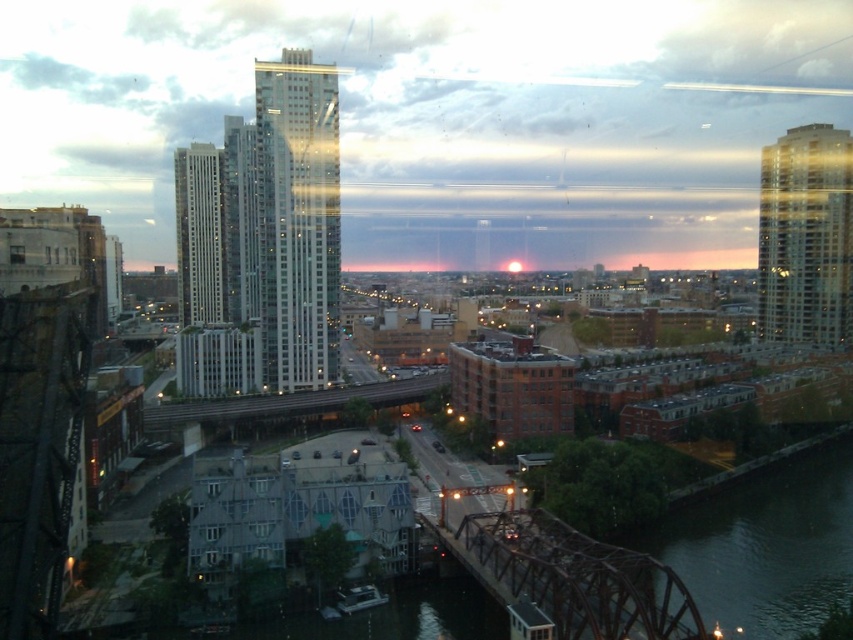
Is matte glass skyscraper at center further to the viewer compared to white glass skyscraper at center?

No, it is in front of white glass skyscraper at center.

Is matte glass skyscraper at center to the left of white glass skyscraper at center from the viewer's perspective?

No, matte glass skyscraper at center is not to the left of white glass skyscraper at center.

Does point (523, 141) lie behind point (200, 161)?

Yes, it is.

The height and width of the screenshot is (640, 853). Identify the location of matte glass skyscraper at center. (438, 116).

Between point (364, 241) and point (769, 202), which one is positioned behind?

Positioned behind is point (364, 241).

Is the position of matte glass skyscraper at center less distant than that of glassy reflective skyscraper at upper right?

Yes, it is.

Who is more forward, (x=485, y=134) or (x=844, y=257)?

Point (x=844, y=257)

The width and height of the screenshot is (853, 640). I want to click on matte glass skyscraper at center, so [x=438, y=116].

From the picture: Is glassy reflective skyscraper at center taller than glassy reflective skyscraper at upper right?

Yes, glassy reflective skyscraper at center is taller than glassy reflective skyscraper at upper right.

Is glassy reflective skyscraper at center behind glassy reflective skyscraper at upper right?

No, glassy reflective skyscraper at center is in front of glassy reflective skyscraper at upper right.

Between point (311, 381) and point (825, 189), which one is positioned in front?

Point (311, 381)

Identify the location of glassy reflective skyscraper at center. The image size is (853, 640). [299, 220].